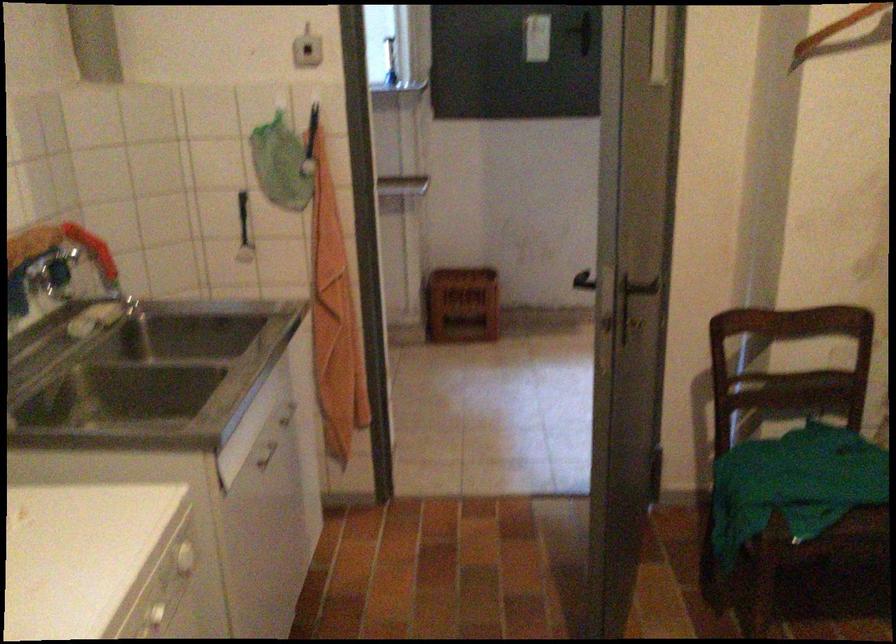
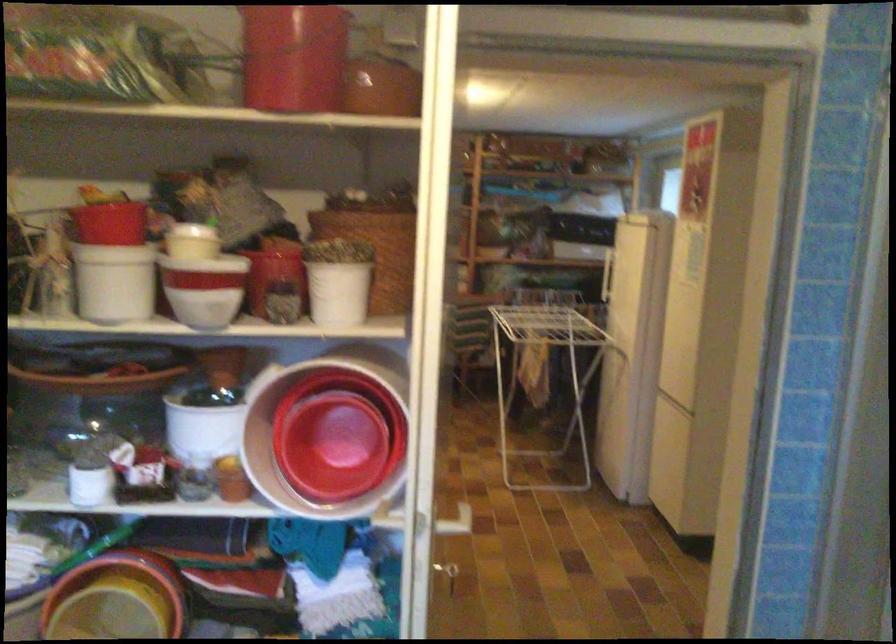
Question: The camera is either moving clockwise (left) or counter-clockwise (right) around the object. The first image is from the beginning of the video and the second image is from the end. Is the camera moving left or right when shooting the video?

Choices:
 (A) Left
 (B) Right

Answer: (A)